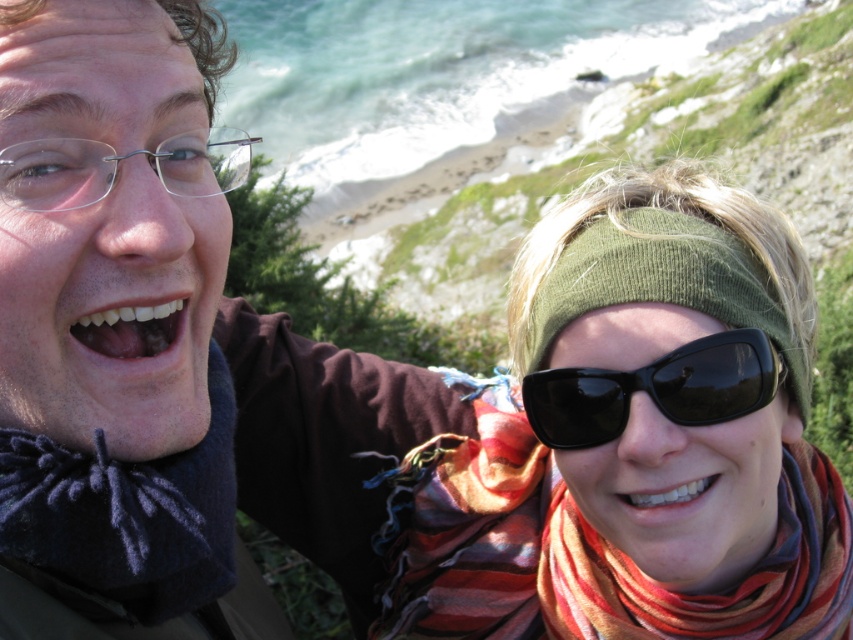
Can you confirm if striped wool scarf at center is shorter than dark blue felt scarf at lower left?

No.

Does striped wool scarf at center appear under dark blue felt scarf at lower left?

Indeed, striped wool scarf at center is positioned under dark blue felt scarf at lower left.

Is point (846, 522) less distant than point (199, 586)?

No, (846, 522) is further to viewer.

Where is `striped wool scarf at center`? This screenshot has height=640, width=853. striped wool scarf at center is located at coordinates (583, 547).

Based on the photo, can you confirm if black plastic sunglasses at right is taller than white glossy teeth at lower right?

Correct, black plastic sunglasses at right is much taller as white glossy teeth at lower right.

You are a GUI agent. You are given a task and a screenshot of the screen. Output one action in this format:
    pyautogui.click(x=<x>, y=<y>)
    Task: Click on the black plastic sunglasses at right
    
    Given the screenshot: What is the action you would take?
    pyautogui.click(x=654, y=388)

Does black plastic sunglasses at right have a smaller size compared to white glossy teeth at center?

No.

Which is below, black plastic sunglasses at right or white glossy teeth at center?

Positioned lower is black plastic sunglasses at right.

The image size is (853, 640). I want to click on black plastic sunglasses at right, so click(x=654, y=388).